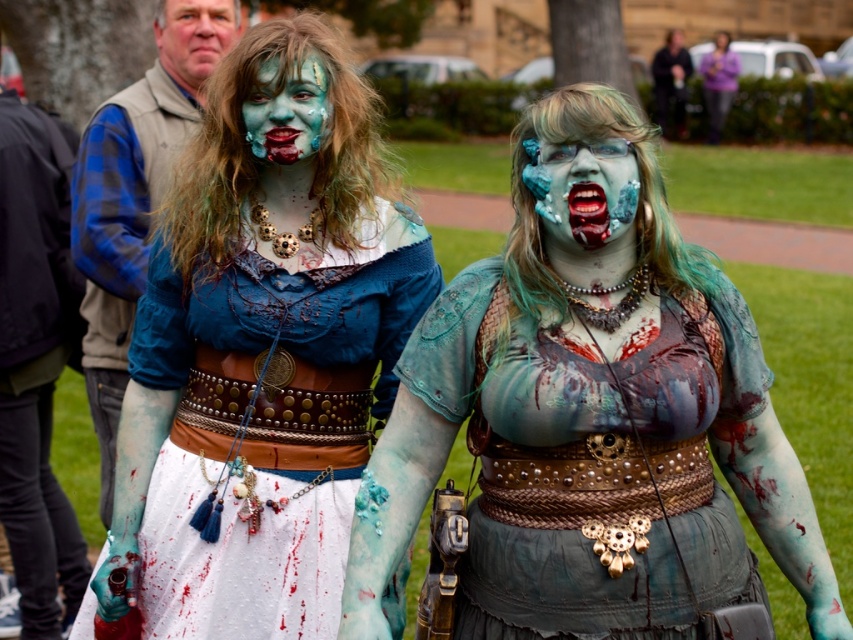
Question: Which point is farther to the camera?

Choices:
 (A) (306, 80)
 (B) (535, 582)
 (C) (190, 84)

Answer: (C)

Question: Is matte leather belt at center bigger than matte skin face at upper left?

Choices:
 (A) yes
 (B) no

Answer: (A)

Question: Does matte blue-green dress at center have a greater width compared to matte skin face at upper left?

Choices:
 (A) yes
 (B) no

Answer: (A)

Question: Is matte blue fabric dress at center smaller than matte leather belt at center?

Choices:
 (A) no
 (B) yes

Answer: (A)

Question: Which point appears closest to the camera in this image?

Choices:
 (A) (276, 136)
 (B) (173, 0)
 (C) (180, 145)
 (D) (560, 148)

Answer: (D)

Question: Which point is farther to the camera?

Choices:
 (A) click(389, 348)
 (B) click(508, 525)
 (C) click(102, 275)

Answer: (C)